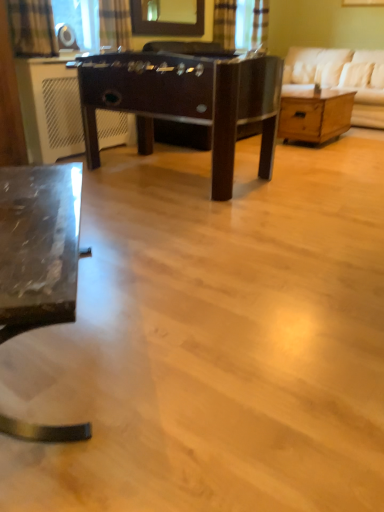
Question: Based on their positions, is white fabric couch at upper right located to the left or right of glossy glass mirror at upper center?

Choices:
 (A) right
 (B) left

Answer: (A)

Question: From the image's perspective, is white fabric couch at upper right above or below glossy glass mirror at upper center?

Choices:
 (A) below
 (B) above

Answer: (A)

Question: Considering the real-world distances, which object is farthest from the glossy glass mirror at upper center?

Choices:
 (A) white fabric couch at upper right
 (B) plaid fabric curtain at upper left, the third curtain when ordered from right to left
 (C) plaid fabric curtain at upper center, the second curtain positioned from the right
 (D) dark brown wood foosball table at center, positioned as the first table in left-to-right order
 (E) metallic glass desk at lower left

Answer: (E)

Question: Which object is positioned farthest from the glossy glass mirror at upper center?

Choices:
 (A) dark brown wood foosball table at center, the second table viewed from the right
 (B) plaid fabric curtain at upper left, which is counted as the 1th curtain, starting from the left
 (C) metallic glass desk at lower left
 (D) wooden drawer at right, the second table viewed from the front
 (E) white fabric couch at upper right

Answer: (C)